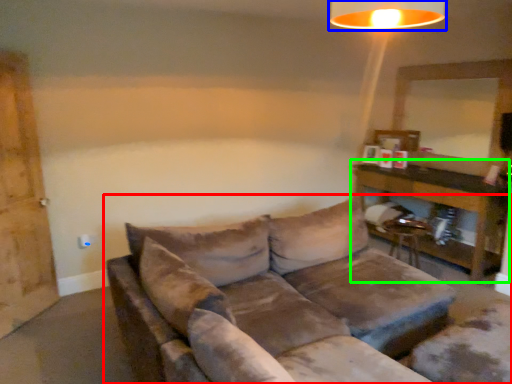
Question: Estimate the real-world distances between objects in this image. Which object is farther from studio couch (highlighted by a red box), lamp (highlighted by a blue box) or table (highlighted by a green box)?

Choices:
 (A) lamp
 (B) table

Answer: (B)